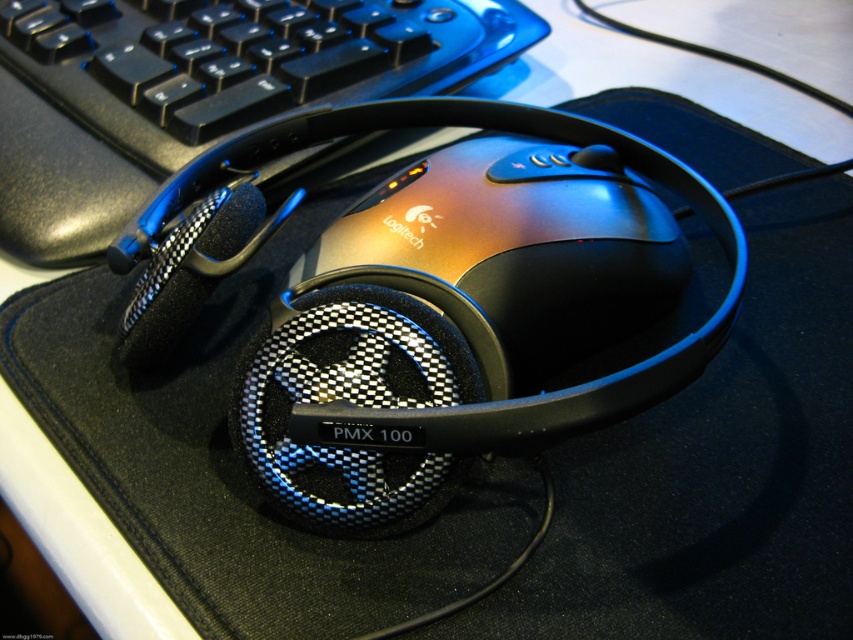
Question: Considering the relative positions of black plastic keyboard at upper left and metallic/reflective logitech mouse at center in the image provided, where is black plastic keyboard at upper left located with respect to metallic/reflective logitech mouse at center?

Choices:
 (A) left
 (B) right

Answer: (A)

Question: Among these points, which one is farthest from the camera?

Choices:
 (A) (374, 28)
 (B) (653, 312)

Answer: (A)

Question: Is black plastic keyboard at upper left bigger than metallic/reflective logitech mouse at center?

Choices:
 (A) yes
 (B) no

Answer: (A)

Question: Is black plastic keyboard at upper left below metallic/reflective logitech mouse at center?

Choices:
 (A) yes
 (B) no

Answer: (B)

Question: Which point is farther to the camera?

Choices:
 (A) (596, 301)
 (B) (78, 56)

Answer: (B)